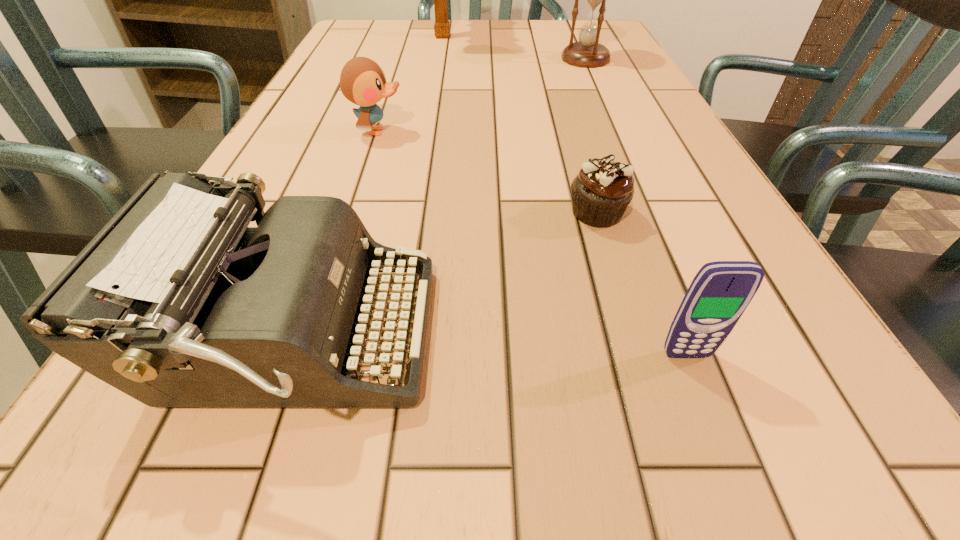
Find the location of `empty location between the third farthest object and the shortest object`. empty location between the third farthest object and the shortest object is located at coordinates (488, 172).

You are a GUI agent. You are given a task and a screenshot of the screen. Output one action in this format:
    pyautogui.click(x=<x>, y=<y>)
    Task: Click on the free space between the tallest object and the cellular telephone
    This screenshot has width=960, height=540.
    Given the screenshot: What is the action you would take?
    564,195

This screenshot has height=540, width=960. Identify the location of object that is the fifth closest to the fifth shortest object. (721, 291).

Select which object appears as the fourth closest to the typewriter. Please provide its 2D coordinates. Your answer should be formatted as a tuple, i.e. [(x, y)], where the tuple contains the x and y coordinates of a point satisfying the conditions above.

[(587, 53)]

At what (x,y) coordinates should I click in order to perform the action: click on free spot that satisfies the following two spatial constraints: 1. on the front-facing side of the fourth farthest object; 2. on the right side of the duck. Please return your answer as a coordinate pair (x, y). Looking at the image, I should click on (351, 213).